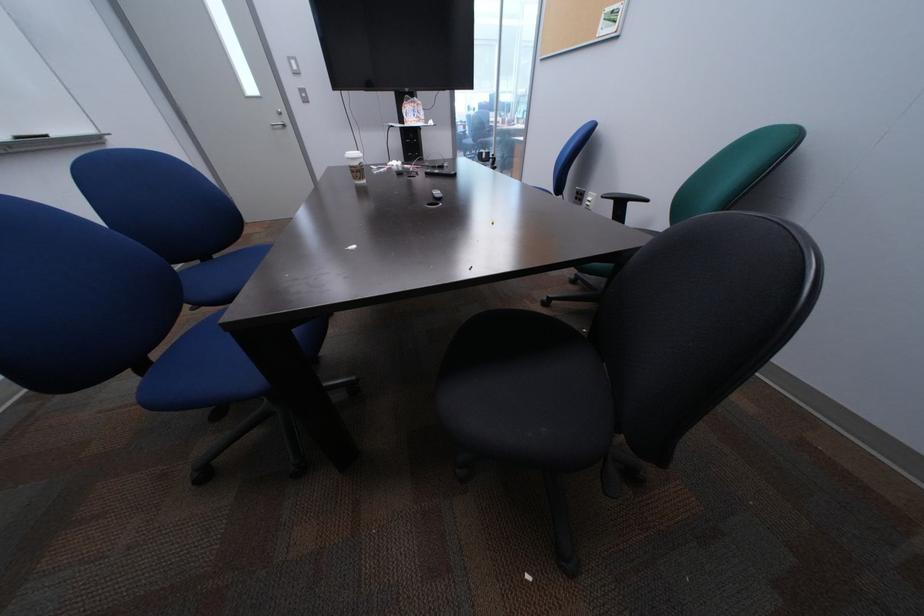
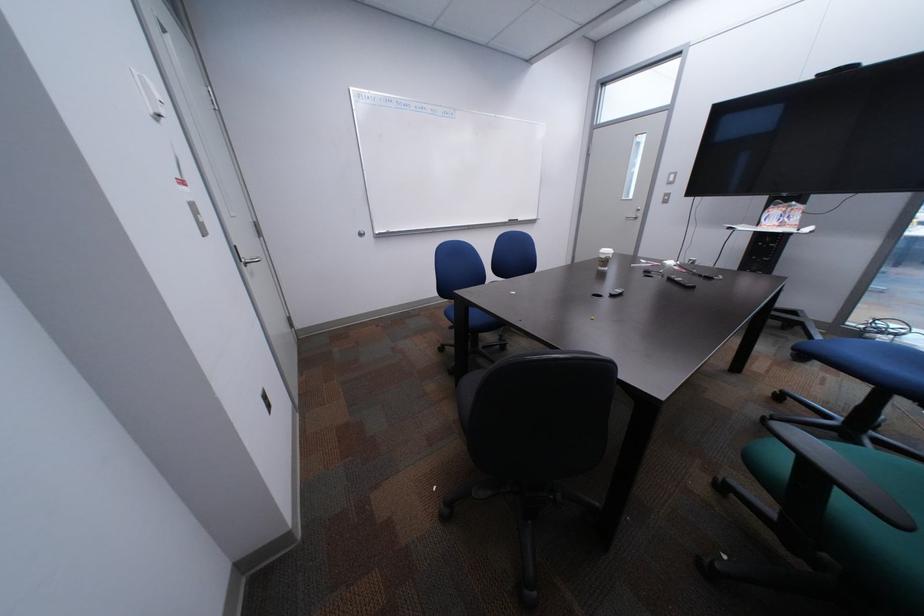
Question: The camera is either moving clockwise (left) or counter-clockwise (right) around the object. The first image is from the beginning of the video and the second image is from the end. Is the camera moving left or right when shooting the video?

Choices:
 (A) Left
 (B) Right

Answer: (B)